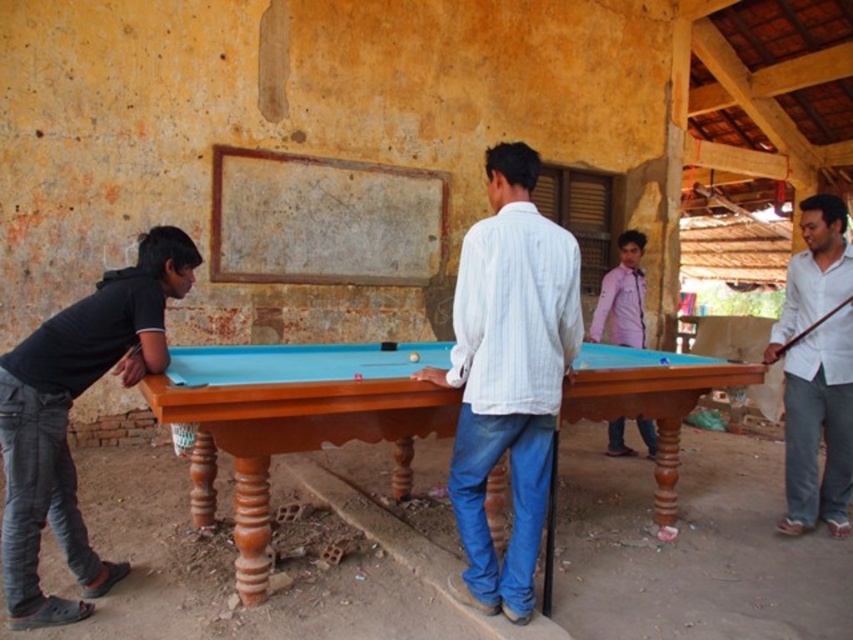
You are standing at the edge of the teal felt pool table at center. Where would you aim to hit the ball to reach the point marked by the coordinate point at (291, 420)?

The point marked by the coordinate point at (291, 420) is exactly where the teal felt pool table at center is located, so aiming there would mean hitting the ball to stay on the table itself.